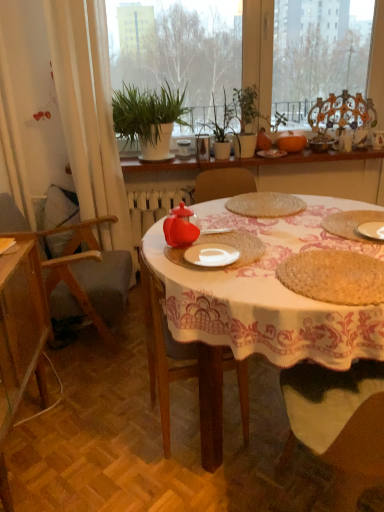
Question: Would you say white ceramic plate at center contains white woven placemat at center?

Choices:
 (A) yes
 (B) no

Answer: (B)

Question: From a real-world perspective, is white ceramic plate at center under white woven placemat at center?

Choices:
 (A) yes
 (B) no

Answer: (B)

Question: Is white ceramic plate at center located outside white woven placemat at center?

Choices:
 (A) no
 (B) yes

Answer: (A)

Question: Is white ceramic plate at center wider than white woven placemat at center?

Choices:
 (A) yes
 (B) no

Answer: (B)

Question: From a real-world perspective, is white ceramic plate at center on white woven placemat at center?

Choices:
 (A) yes
 (B) no

Answer: (A)

Question: From the image's perspective, is white ceramic plate at center located above white woven placemat at center?

Choices:
 (A) no
 (B) yes

Answer: (B)

Question: Does transparent glass chair at upper right, which is the 3th chair from front to back, turn towards white woven placemat at center?

Choices:
 (A) yes
 (B) no

Answer: (A)

Question: From a real-world perspective, is transparent glass chair at upper right, the 1th chair in the top-to-bottom sequence, positioned under white woven placemat at center based on gravity?

Choices:
 (A) no
 (B) yes

Answer: (A)

Question: Does transparent glass chair at upper right, the 1th chair positioned from the right, have a lesser width compared to white woven placemat at center?

Choices:
 (A) yes
 (B) no

Answer: (A)

Question: Can you confirm if transparent glass chair at upper right, the 1th chair positioned from the right, is wider than white woven placemat at center?

Choices:
 (A) no
 (B) yes

Answer: (A)

Question: Does transparent glass chair at upper right, the 1th chair in the top-to-bottom sequence, come behind white woven placemat at center?

Choices:
 (A) yes
 (B) no

Answer: (A)

Question: From a real-world perspective, is transparent glass chair at upper right, the first chair in the back-to-front sequence, on white woven placemat at center?

Choices:
 (A) yes
 (B) no

Answer: (A)

Question: Is transparent glass chair at upper right, which is the third chair in left-to-right order, closer to the viewer compared to green matte plant at center?

Choices:
 (A) yes
 (B) no

Answer: (B)